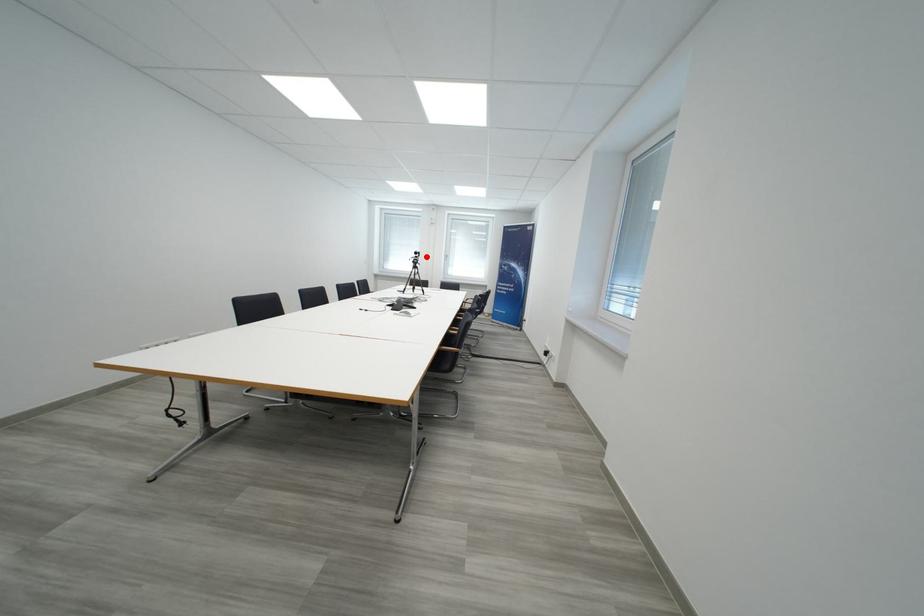
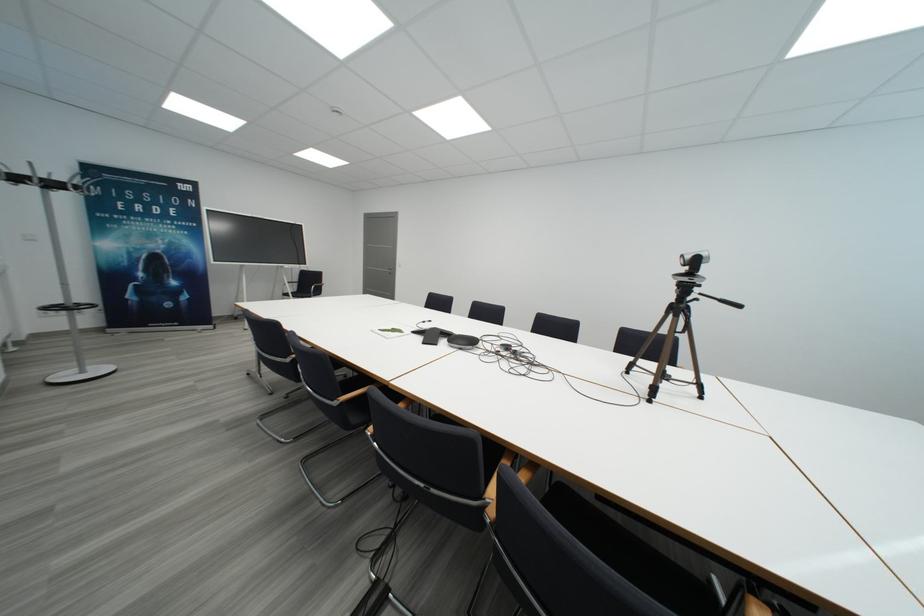
The point at the highlighted location is marked in the first image. Where is the corresponding point in the second image?

(702, 265)